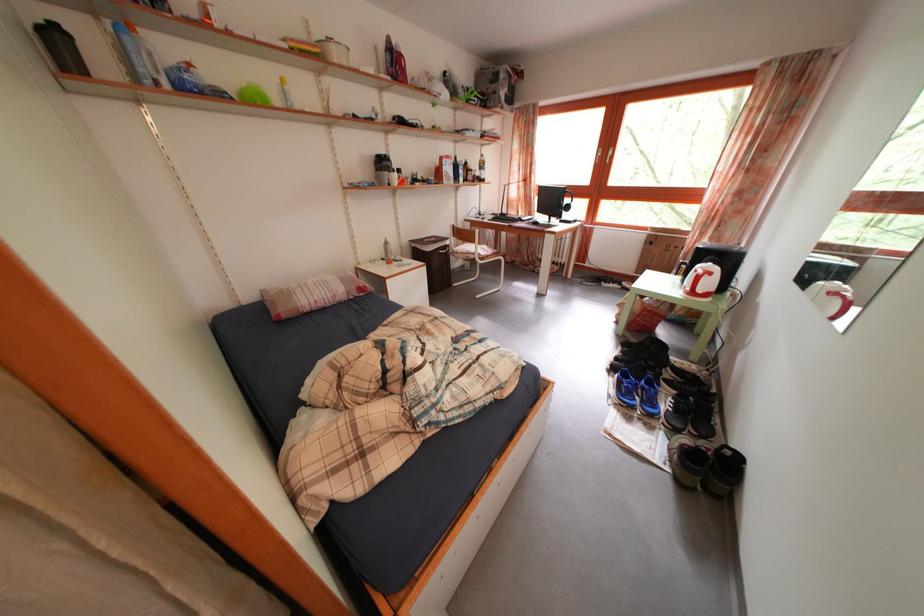
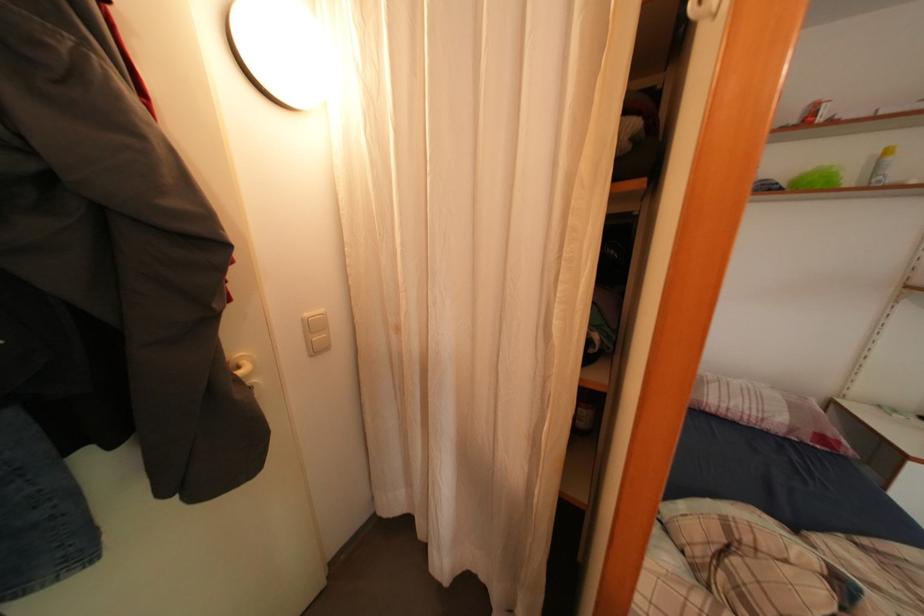
Question: The camera is either moving clockwise (left) or counter-clockwise (right) around the object. The first image is from the beginning of the video and the second image is from the end. Is the camera moving left or right when shooting the video?

Choices:
 (A) Left
 (B) Right

Answer: (B)